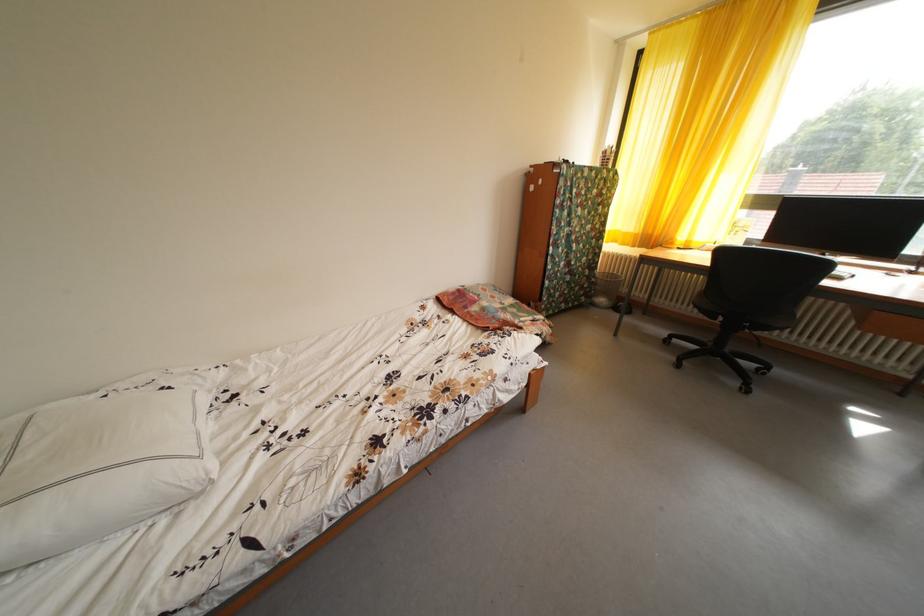
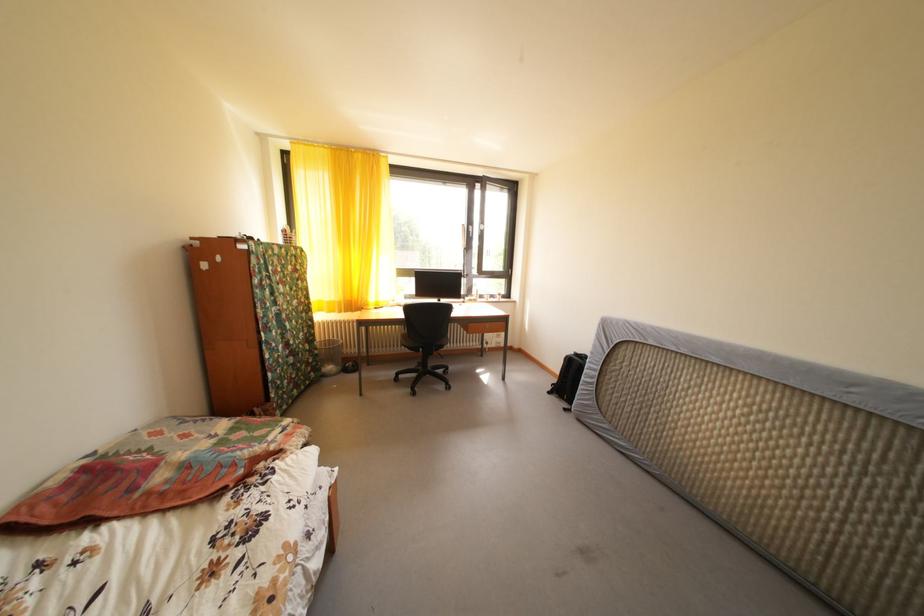
Locate, in the second image, the point that corresponds to (502,302) in the first image.

(195, 442)